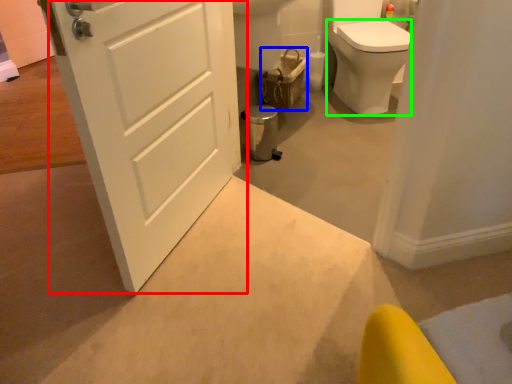
Question: Considering the real-world distances, which object is farthest from door (highlighted by a red box)? basket (highlighted by a blue box) or bidet (highlighted by a green box)?

Choices:
 (A) basket
 (B) bidet

Answer: (B)